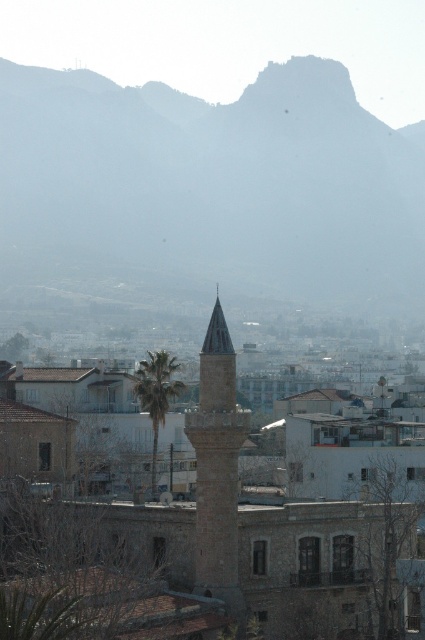
You are a tourist standing at the town square and want to take a photo of the smooth stone minaret at center. Based on its coordinates, which direction should you face to capture it in your shot?

The smooth stone minaret at center is located at coordinates point (x=217, y=465), which means it is positioned towards the upper right of the image. To capture it in your shot, you should face towards the upper right direction.

You are a photographer planning to capture the entire scene in one shot. Given that your camera can only focus on objects within a 100m width, can you determine if the gray rocky mountain at upper center and the smooth stone minaret at center will both fit within the camera frame?

The gray rocky mountain at upper center might be wider than smooth stone minaret at center, so it is possible that the total width of both objects exceeds the camera frame limit of 100m. Therefore, it is uncertain if both will fit within the camera frame.

You are standing in the town square and want to reach a hidden treasure located at point (159, 369). There is an obstacle at point (22, 221) blocking your path. Can you walk directly from your current position to the treasure without going around the obstacle?

The obstacle at point (22, 221) is closer to you than the treasure at point (159, 369). Therefore, you can walk directly to the treasure as the obstacle is in front of your path and you can step around it if needed.